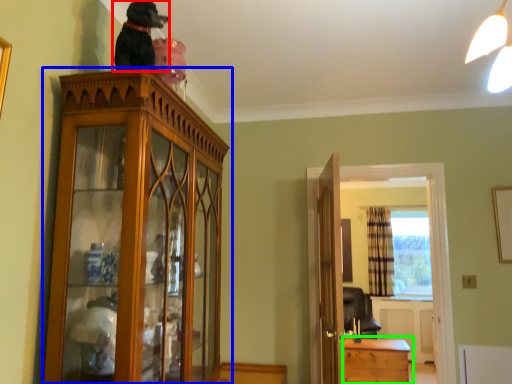
Question: Based on their relative distances, which object is farther from dog (highlighted by a red box)? Choose from cabinetry (highlighted by a blue box) and table (highlighted by a green box).

Choices:
 (A) cabinetry
 (B) table

Answer: (B)